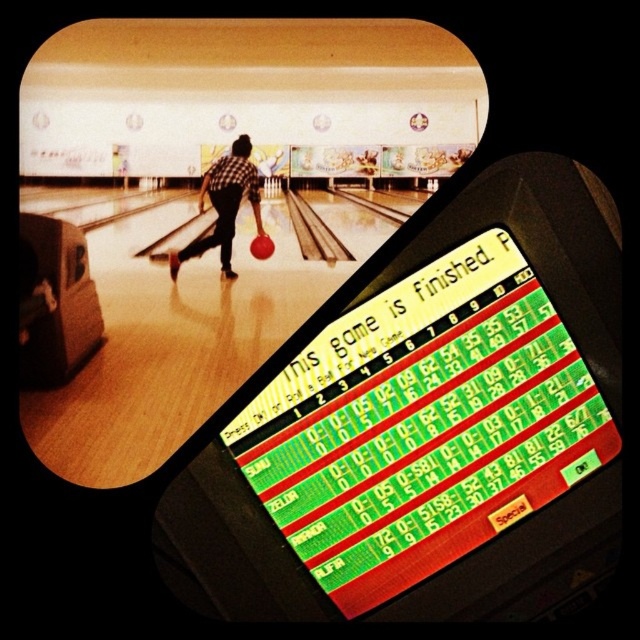
Can you confirm if checkered fabric shirt at center is thinner than shiny red bowling ball at center?

No, checkered fabric shirt at center is not thinner than shiny red bowling ball at center.

Is point (200, 211) farther from camera compared to point (266, 237)?

No, it is not.

Where is `checkered fabric shirt at center`? The image size is (640, 640). checkered fabric shirt at center is located at coordinates (224, 204).